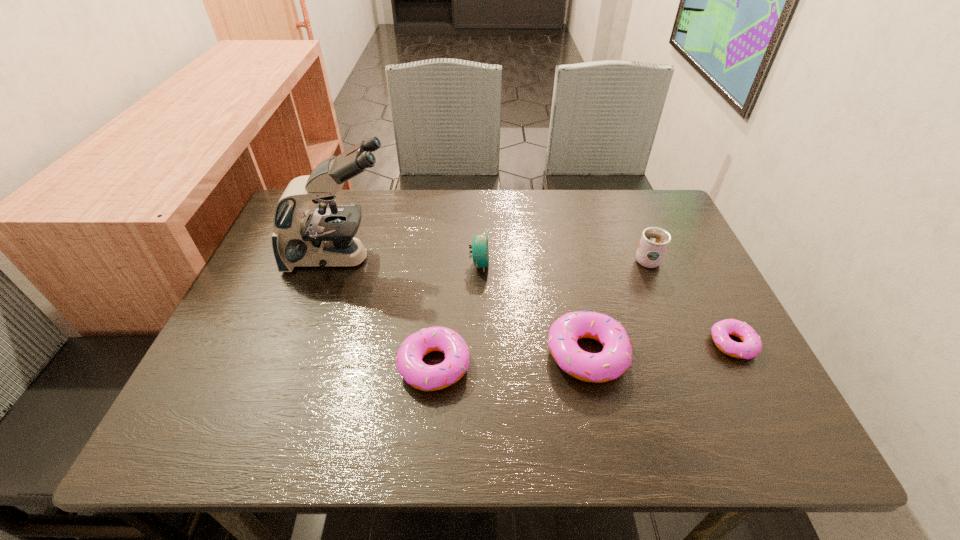
Identify the location of the second shortest doughnut. (419, 375).

Where is `the leftmost doughnut`? This screenshot has height=540, width=960. the leftmost doughnut is located at coordinates (419, 375).

Locate an element on the screen. The image size is (960, 540). the fourth object from left to right is located at coordinates click(615, 358).

At what (x,y) coordinates should I click in order to perform the action: click on the rightmost doughnut. Please return your answer as a coordinate pair (x, y). The width and height of the screenshot is (960, 540). Looking at the image, I should click on (752, 345).

Locate an element on the screen. This screenshot has width=960, height=540. the shortest doughnut is located at coordinates (752, 345).

Locate an element on the screen. the fifth object from left to right is located at coordinates (654, 242).

At what (x,y) coordinates should I click in order to perform the action: click on cup. Please return your answer as a coordinate pair (x, y). Looking at the image, I should click on (654, 242).

Locate an element on the screen. microscope is located at coordinates (323, 237).

I want to click on the tallest object, so click(x=323, y=237).

Locate an element on the screen. The image size is (960, 540). the third tallest object is located at coordinates (480, 248).